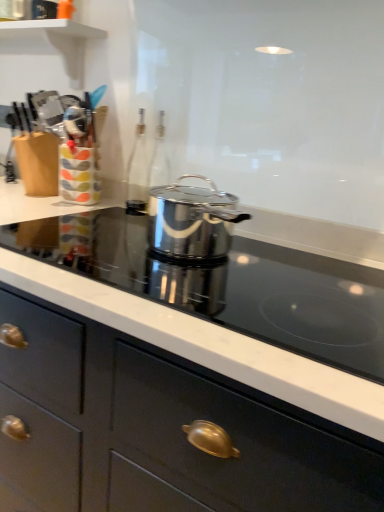
Measure the distance between polished stainless steel pot at center and camera.

polished stainless steel pot at center is 21.70 inches from camera.

Describe the element at coordinates (227, 285) in the screenshot. I see `polished stainless steel pot at center` at that location.

Find the location of a particular element. Image resolution: width=384 pixels, height=512 pixels. polished stainless steel pot at center is located at coordinates (227, 285).

Identify the location of polished stainless steel pot at center. This screenshot has width=384, height=512. (227, 285).